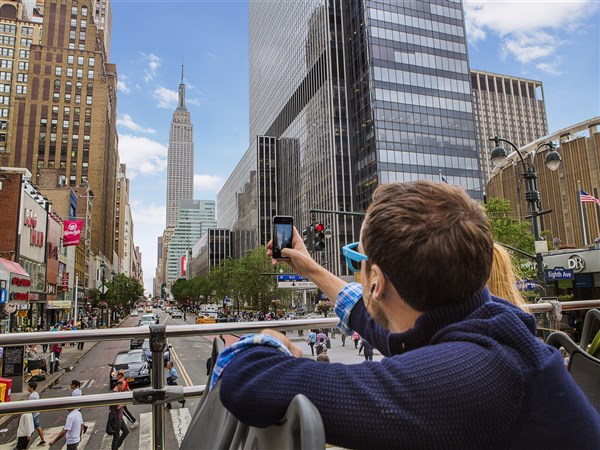
Identify the location of phone. The width and height of the screenshot is (600, 450). (x=280, y=234).